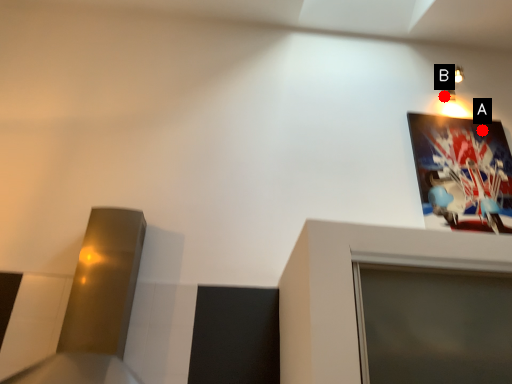
Question: Two points are circled on the image, labeled by A and B beside each circle. Among these points, which one is farthest from the camera?

Choices:
 (A) A is further
 (B) B is further

Answer: (B)